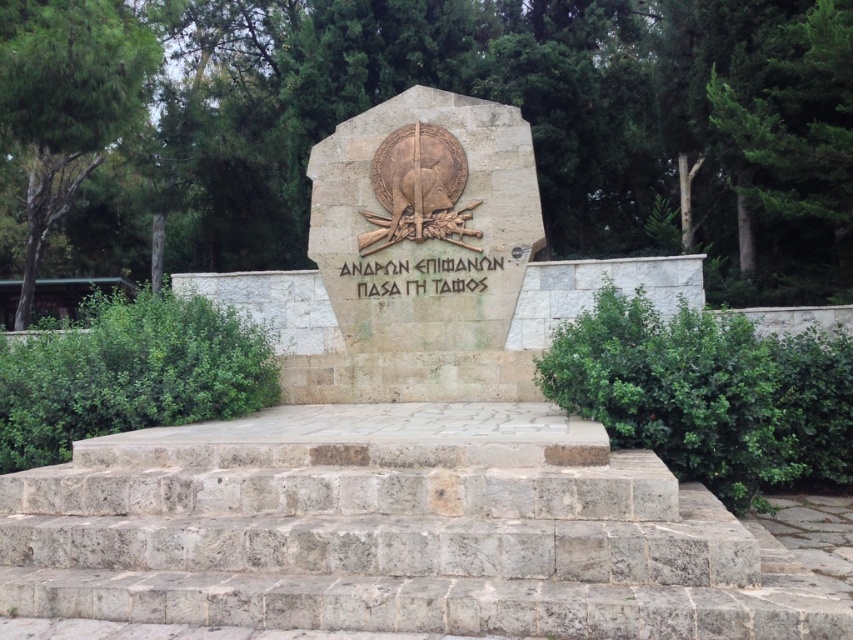
Question: Which point is farther to the camera?

Choices:
 (A) (404, 468)
 (B) (444, 291)

Answer: (B)

Question: Is gray stone stairs at center closer to the viewer compared to stone textured monument at center?

Choices:
 (A) no
 (B) yes

Answer: (B)

Question: From the image, what is the correct spatial relationship of gray stone stairs at center in relation to stone textured monument at center?

Choices:
 (A) left
 (B) right

Answer: (A)

Question: Is gray stone stairs at center above stone textured monument at center?

Choices:
 (A) no
 (B) yes

Answer: (A)

Question: Which point is closer to the camera?

Choices:
 (A) gray stone stairs at center
 (B) stone textured monument at center

Answer: (A)